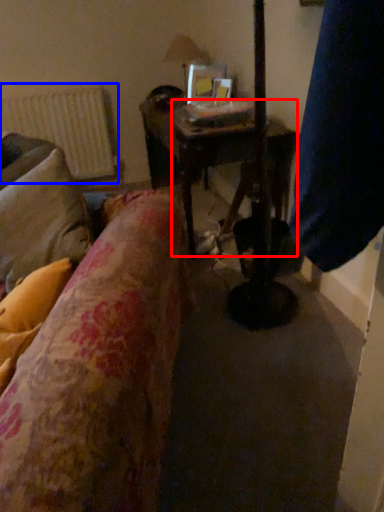
Question: Which object is further to the camera taking this photo, table (highlighted by a red box) or radiator (highlighted by a blue box)?

Choices:
 (A) table
 (B) radiator

Answer: (B)